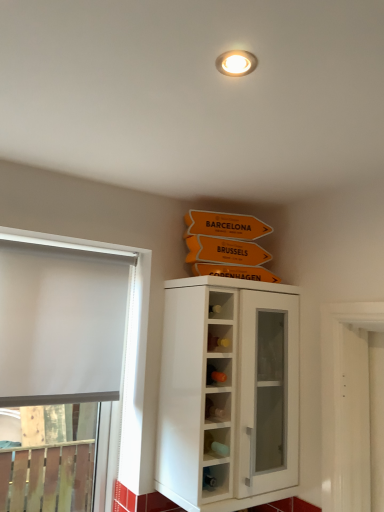
What do you see at coordinates (71, 368) in the screenshot? I see `white matte window at left` at bounding box center [71, 368].

Where is `white matte window at left`? The image size is (384, 512). white matte window at left is located at coordinates (71, 368).

What do you see at coordinates (227, 391) in the screenshot? I see `white glossy cupboard at center` at bounding box center [227, 391].

Find the location of a particular element. This screenshot has height=512, width=384. white glossy cupboard at center is located at coordinates (227, 391).

Where is `white matte window at left`? The height and width of the screenshot is (512, 384). white matte window at left is located at coordinates pos(71,368).

Between white matte window at left and white glossy cupboard at center, which one appears on the right side from the viewer's perspective?

Positioned to the right is white glossy cupboard at center.

Considering the relative positions of white matte window at left and white glossy cupboard at center in the image provided, is white matte window at left in front of white glossy cupboard at center?

No.

Considering the positions of point (7, 262) and point (199, 356), is point (7, 262) closer or farther from the camera than point (199, 356)?

Point (7, 262) appears to be farther away from the viewer than point (199, 356).

From the image's perspective, is white matte window at left below white glossy cupboard at center?

No, from the image's perspective, white matte window at left is not beneath white glossy cupboard at center.

From a real-world perspective, between white matte window at left and white glossy cupboard at center, who is vertically lower?

In real-world perspective, white matte window at left is lower.

Which of these two, white matte window at left or white glossy cupboard at center, is thinner?

Thinner between the two is white matte window at left.

Is white matte window at left taller or shorter than white glossy cupboard at center?

In the image, white matte window at left appears to be taller than white glossy cupboard at center.

Which of these two, white matte window at left or white glossy cupboard at center, is bigger?

white glossy cupboard at center is bigger.

Is white matte window at left not inside white glossy cupboard at center?

Yes, white matte window at left is not within white glossy cupboard at center.

Looking at this image, is white matte window at left not near white glossy cupboard at center?

Yes.

Is white matte window at left oriented towards white glossy cupboard at center?

No, white matte window at left is not aimed at white glossy cupboard at center.

Identify the location of window lying above the white glossy cupboard at center (from the image's perspective). (71, 368).

Is white glossy cupboard at center at the left side of white matte window at left?

No, white glossy cupboard at center is not to the left of white matte window at left.

Relative to white matte window at left, is white glossy cupboard at center in front or behind?

white glossy cupboard at center is in front of white matte window at left.

Is point (260, 320) farther from viewer compared to point (147, 324)?

Yes, point (260, 320) is behind point (147, 324).

From the image's perspective, is white glossy cupboard at center positioned above or below white matte window at left?

Clearly, from the image's perspective, white glossy cupboard at center is below white matte window at left.

From a real-world perspective, relative to white matte window at left, is white glossy cupboard at center vertically above or below?

white glossy cupboard at center is above white matte window at left.

In terms of width, does white glossy cupboard at center look wider or thinner when compared to white matte window at left?

Answer: In the image, white glossy cupboard at center appears to be wider than white matte window at left.

Can you confirm if white glossy cupboard at center is shorter than white matte window at left?

Indeed, white glossy cupboard at center has a lesser height compared to white matte window at left.

Is white glossy cupboard at center bigger or smaller than white matte window at left?

Clearly, white glossy cupboard at center is larger in size than white matte window at left.

Is white glossy cupboard at center positioned beyond the bounds of white matte window at left?

Indeed, white glossy cupboard at center is completely outside white matte window at left.

Is white glossy cupboard at center next to white matte window at left and touching it?

No, white glossy cupboard at center is not next to white matte window at left.

Is white glossy cupboard at center facing away from white matte window at left?

white glossy cupboard at center is not turned away from white matte window at left.

How many degrees apart are the facing directions of white glossy cupboard at center and white matte window at left?

0.00623 degrees separate the facing orientations of white glossy cupboard at center and white matte window at left.

Where is `window located behind the white glossy cupboard at center`? window located behind the white glossy cupboard at center is located at coordinates (71, 368).

The image size is (384, 512). Identify the location of window behind the white glossy cupboard at center. (71, 368).

The image size is (384, 512). What are the coordinates of `cupboard to the right of white matte window at left` in the screenshot? It's located at (227, 391).